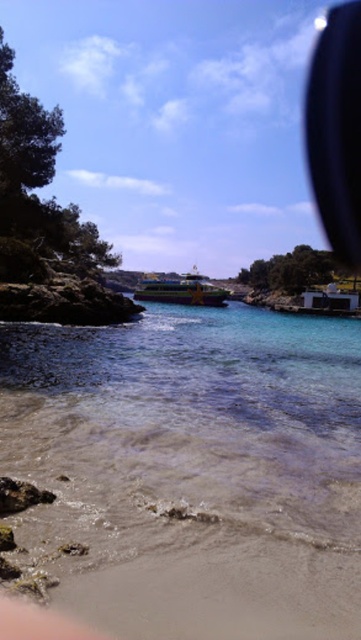
You are standing on the beach and want to take a photo of the green plastic boat at center. You notice a black glossy view mirror at upper right in your view. Which object is positioned to the right side of the other?

The black glossy view mirror at upper right is to the right of the green plastic boat at center.

You are standing on the beach in the scene and want to swim in the clearest part of the water. According to the coordinates provided, where should you head to reach the clear water at center?

The clear water at center is located at coordinates point (190,472), so you should head towards the center of the image where the coordinates point to reach it.